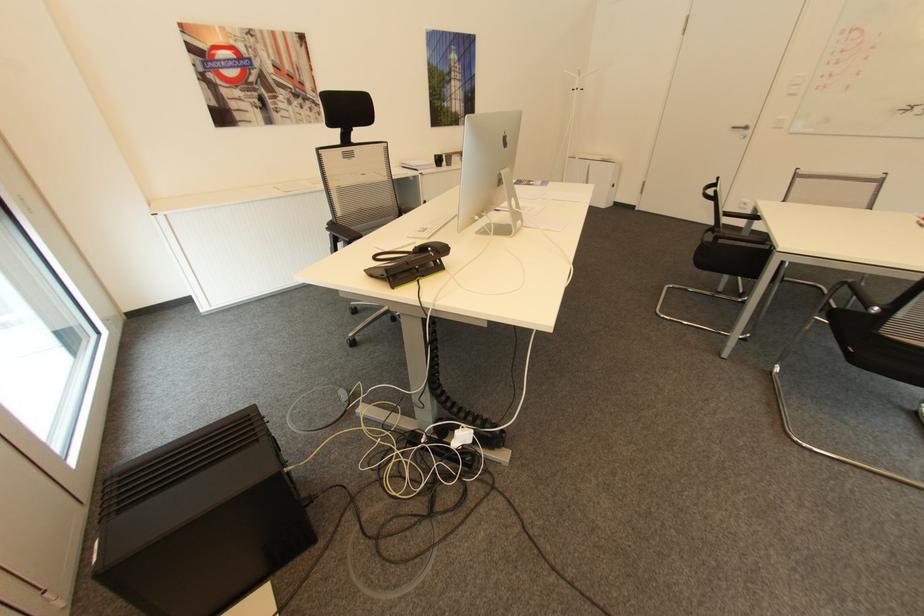
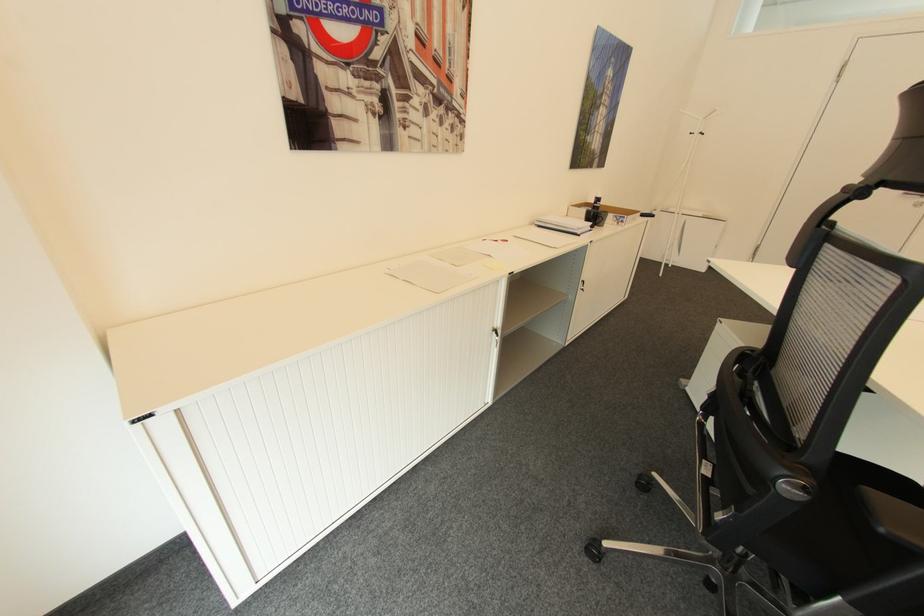
In a continuous first-person perspective shot, in which direction is the camera moving?

The cameraman walked toward left, forward.